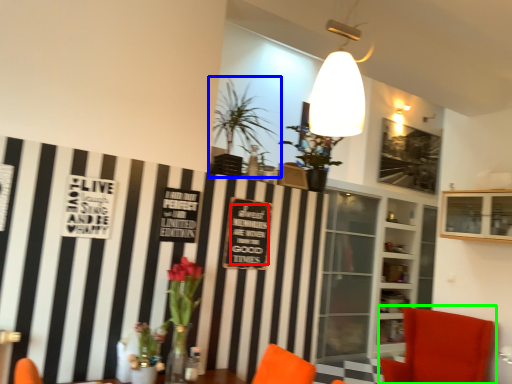
Question: Based on their relative distances, which object is farther from writing (highlighted by a red box)? Choose from houseplant (highlighted by a blue box) and chair (highlighted by a green box).

Choices:
 (A) houseplant
 (B) chair

Answer: (B)